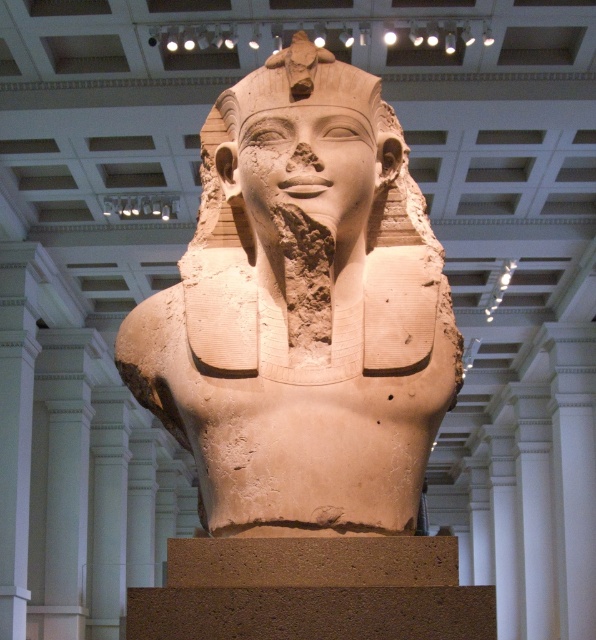
Between beige stone bust at center and beige stone head at center, which one is positioned higher?

beige stone head at center is above.

Is point (219, 186) positioned in front of point (309, 64)?

No, (219, 186) is behind (309, 64).

Locate an element on the screen. beige stone bust at center is located at coordinates (302, 310).